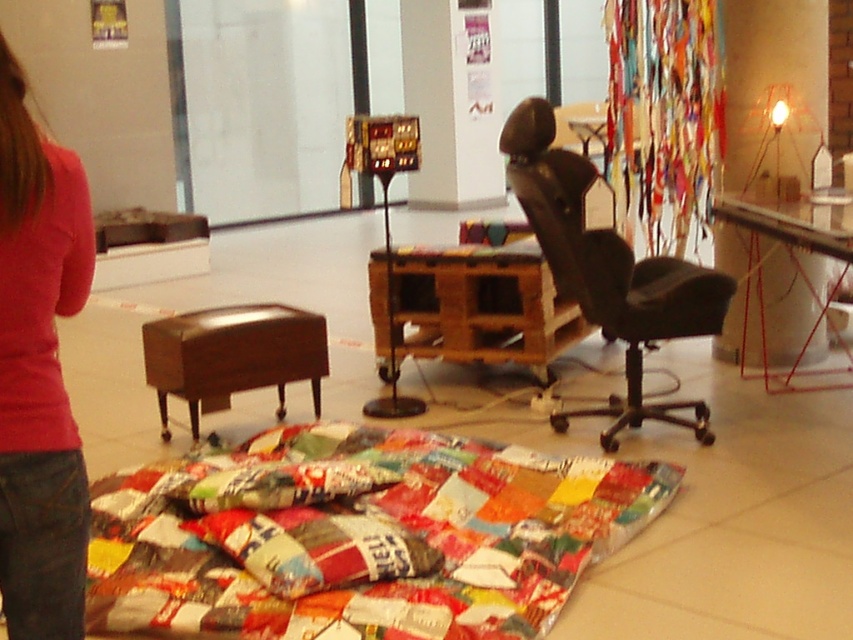
Question: Which point is closer to the camera?

Choices:
 (A) (631, 264)
 (B) (561, 572)

Answer: (B)

Question: Can you confirm if white glossy pillar at upper right is smaller than black leather swivel chair at center right?

Choices:
 (A) yes
 (B) no

Answer: (A)

Question: Based on their relative distances, which object is farther from the black leather swivel chair at center right?

Choices:
 (A) white glossy pillar at upper right
 (B) patchwork fabric at center
 (C) brown leather stool at lower left

Answer: (C)

Question: Is patchwork fabric at center to the left of white glossy pillar at upper right from the viewer's perspective?

Choices:
 (A) yes
 (B) no

Answer: (A)

Question: Does pink fabric at lower left lie in front of white glossy pillar at upper right?

Choices:
 (A) yes
 (B) no

Answer: (A)

Question: Which object is closer to the camera taking this photo?

Choices:
 (A) brown leather stool at lower left
 (B) patchwork fabric at center
 (C) white glossy pillar at upper right
 (D) black leather swivel chair at center right

Answer: (B)